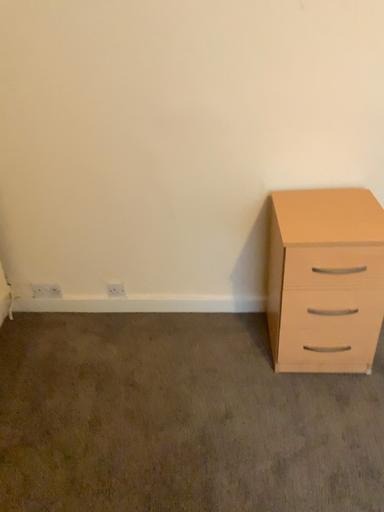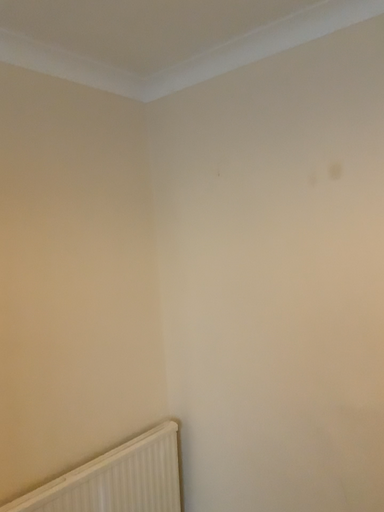
Question: Which way did the camera rotate in the video?

Choices:
 (A) rotated left
 (B) rotated right

Answer: (A)